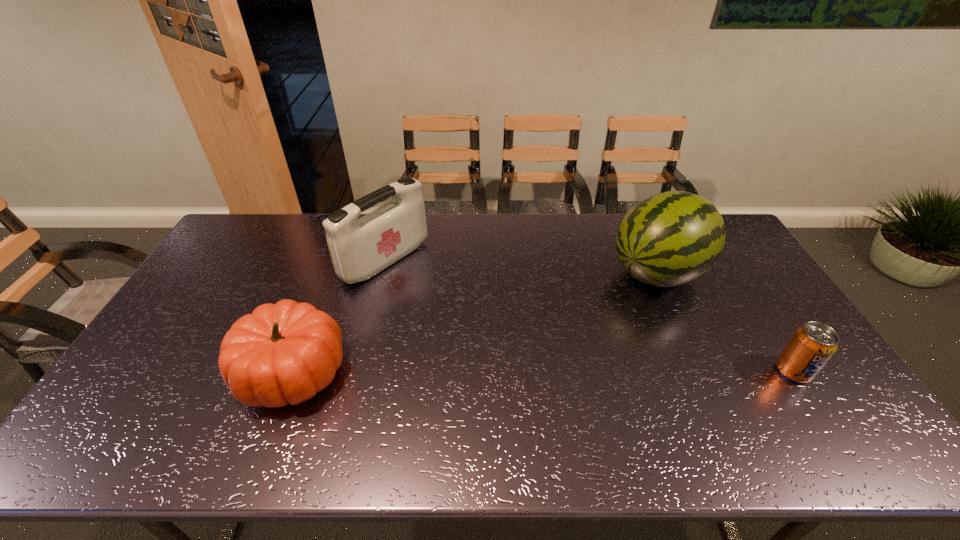
This screenshot has width=960, height=540. In order to click on blank space located 0.250m at the stem end of the watermelon in this screenshot , I will do `click(567, 326)`.

At what (x,y) coordinates should I click in order to perform the action: click on free point located at the stem end of the watermelon. Please return your answer as a coordinate pair (x, y). Looking at the image, I should click on (613, 299).

Identify the location of vacant space situated at the stem end of the watermelon. The width and height of the screenshot is (960, 540). (564, 328).

The image size is (960, 540). I want to click on the first-aid kit at the far edge, so click(360, 248).

The width and height of the screenshot is (960, 540). I want to click on watermelon situated at the far edge, so click(671, 238).

This screenshot has width=960, height=540. In order to click on object situated at the near edge in this screenshot , I will do `click(284, 353)`.

Locate an element on the screen. This screenshot has height=540, width=960. object situated at the right edge is located at coordinates (812, 345).

Identify the location of vacant area at the far edge. The width and height of the screenshot is (960, 540). (574, 237).

Locate an element on the screen. The width and height of the screenshot is (960, 540). free space at the near edge of the desktop is located at coordinates tap(734, 391).

At what (x,y) coordinates should I click in order to perform the action: click on free space at the left edge of the desktop. Please return your answer as a coordinate pair (x, y). Looking at the image, I should click on (151, 347).